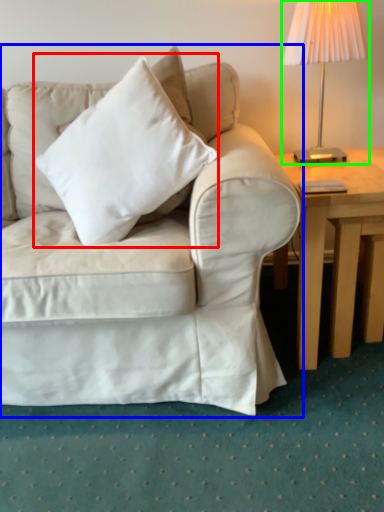
Question: Which is farther away from pillow (highlighted by a red box)? studio couch (highlighted by a blue box) or lamp (highlighted by a green box)?

Choices:
 (A) studio couch
 (B) lamp

Answer: (B)